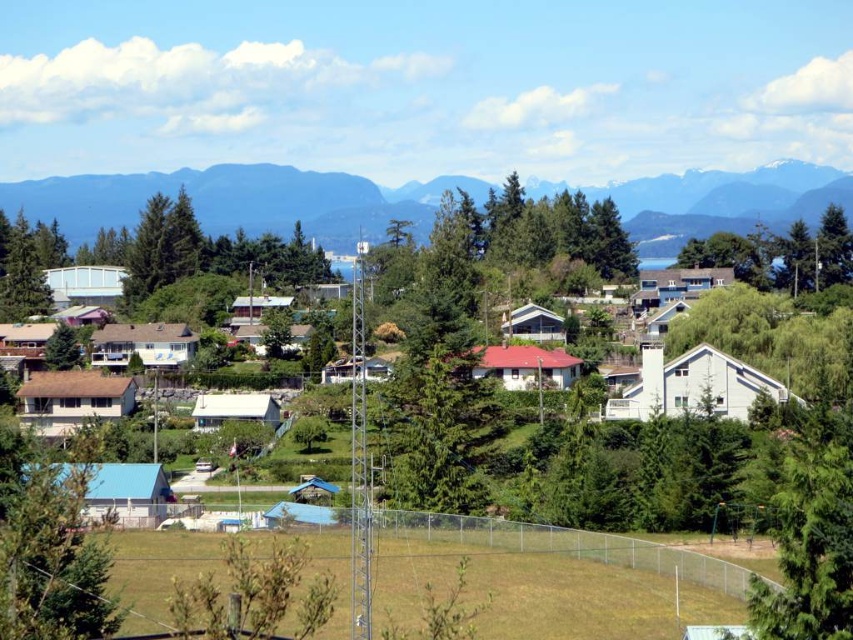
At what (x,y) coordinates should I click in order to perform the action: click on green forested mountain at upper center. Please return your answer as a coordinate pair (x, y). Image resolution: width=853 pixels, height=640 pixels. Looking at the image, I should click on point(239,200).

Is green forested mountain at upper center thinner than green leafy tree at lower left?

Incorrect, green forested mountain at upper center's width is not less than green leafy tree at lower left's.

This screenshot has width=853, height=640. What do you see at coordinates (239, 200) in the screenshot?
I see `green forested mountain at upper center` at bounding box center [239, 200].

Locate an element on the screen. green forested mountain at upper center is located at coordinates (239, 200).